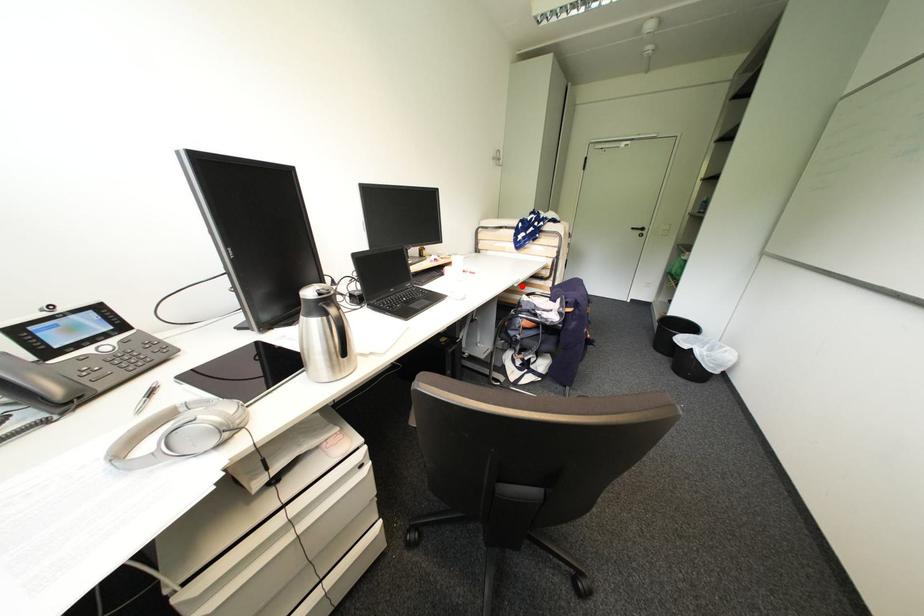
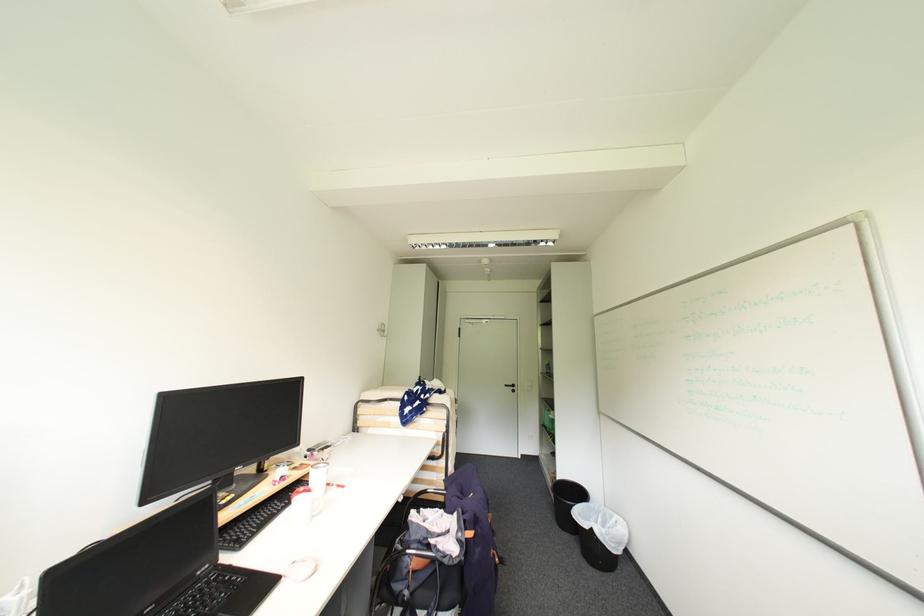
Locate, in the second image, the point that corresponds to the highlighted location in the first image.

(407, 501)